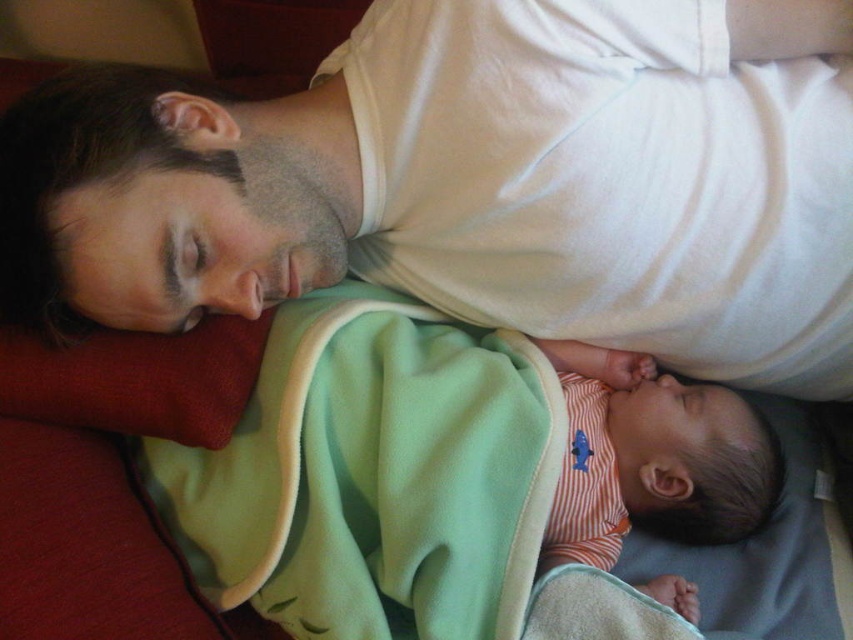
You are a photographer who needs to capture a closeup shot of the orange striped fabric at lower center and the orange striped fabric at center. The camera lens has a maximum focus range of 3 inches. Can you take a photo of both fabrics without moving the camera?

The distance between the orange striped fabric at lower center and the orange striped fabric at center is 3.44 inches, which exceeds the camera lens maximum focus range of 3 inches. Therefore, you cannot capture both fabrics in focus without moving the camera.

You are a photographer taking a picture of the scene. You need to focus on the point that is closer to the camera. Which point should you choose between point (461, 84) and point (693, 461)?

Point (461, 84) is in front of point (693, 461), so you should focus on point (461, 84) since it is closer to the camera.